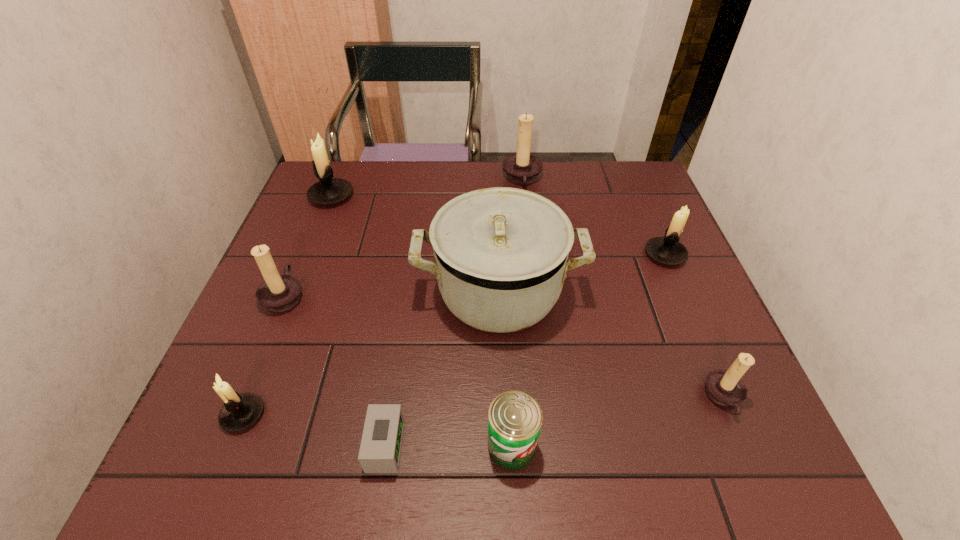
At what (x,y) coordinates should I click in order to perform the action: click on the smallest brown candle holder. Please return your answer as a coordinate pair (x, y). This screenshot has height=540, width=960. Looking at the image, I should click on (726, 388).

Where is `can`? The width and height of the screenshot is (960, 540). can is located at coordinates (514, 421).

Locate an element on the screen. The height and width of the screenshot is (540, 960). alarm clock is located at coordinates (380, 449).

This screenshot has width=960, height=540. What are the coordinates of `vacant space located on the wick of the farthest brown candle holder` in the screenshot? It's located at (431, 179).

The height and width of the screenshot is (540, 960). I want to click on vacant region located 0.390m on the wick of the farthest brown candle holder, so click(x=376, y=179).

Locate an element on the screen. The height and width of the screenshot is (540, 960). free location located on the wick of the farthest brown candle holder is located at coordinates (486, 179).

You are a GUI agent. You are given a task and a screenshot of the screen. Output one action in this format:
    pyautogui.click(x=<x>, y=<y>)
    Task: Click on the free space located 0.100m on the back of the biggest white candle holder
    The height and width of the screenshot is (540, 960).
    Given the screenshot: What is the action you would take?
    pyautogui.click(x=344, y=166)

The width and height of the screenshot is (960, 540). What are the coordinates of `vacant space located on the front of the white saucepan` in the screenshot? It's located at (505, 423).

At what (x,y) coordinates should I click in order to perform the action: click on free space located 0.400m on the wick of the second nearest brown candle holder. Please return your answer as a coordinate pair (x, y). Looking at the image, I should click on click(476, 295).

I want to click on vacant area situated 0.090m on the front of the second farthest white candle holder, so click(x=683, y=296).